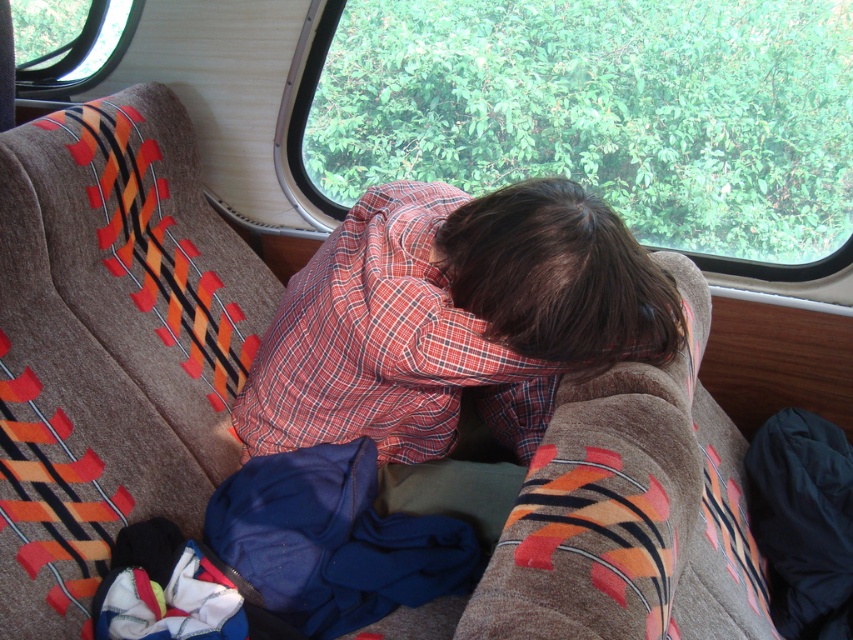
Is red plaid shirt at center bigger than blue fleece sleeping bag at lower center?

Yes, red plaid shirt at center is bigger than blue fleece sleeping bag at lower center.

Where is `red plaid shirt at center`? The width and height of the screenshot is (853, 640). red plaid shirt at center is located at coordinates (451, 320).

Locate an element on the screen. red plaid shirt at center is located at coordinates (451, 320).

Is red plaid shirt at center to the left of black fabric at lower right from the viewer's perspective?

Yes, red plaid shirt at center is to the left of black fabric at lower right.

At what (x,y) coordinates should I click in order to perform the action: click on red plaid shirt at center. Please return your answer as a coordinate pair (x, y). The height and width of the screenshot is (640, 853). Looking at the image, I should click on (451, 320).

Is blue fleece sleeping bag at lower center smaller than black fabric at lower right?

Indeed, blue fleece sleeping bag at lower center has a smaller size compared to black fabric at lower right.

Which of these two, blue fleece sleeping bag at lower center or black fabric at lower right, stands shorter?

blue fleece sleeping bag at lower center

Is point (412, 588) positioned in front of point (830, 547)?

Yes, it is.

Image resolution: width=853 pixels, height=640 pixels. Identify the location of blue fleece sleeping bag at lower center. (334, 540).